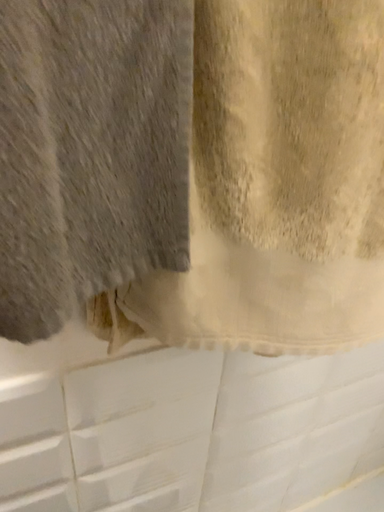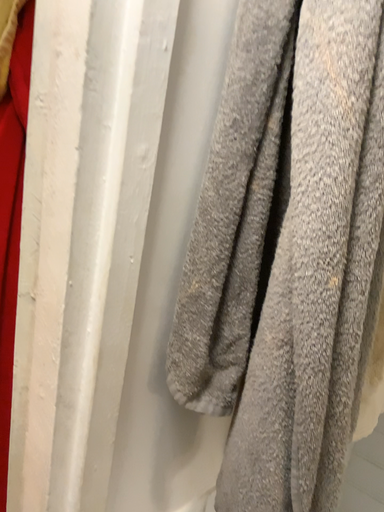
Question: How did the camera likely rotate when shooting the video?

Choices:
 (A) rotated downward
 (B) rotated upward

Answer: (B)